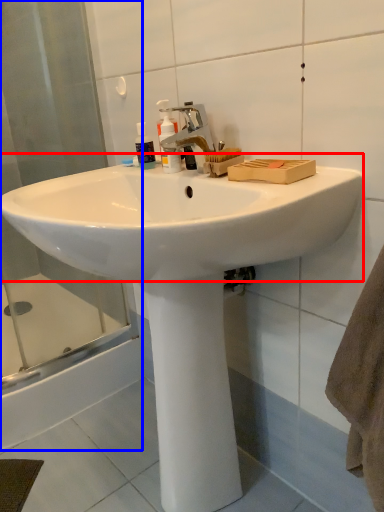
Question: Which of the following is the closest to the observer, sink (highlighted by a red box) or shower door (highlighted by a blue box)?

Choices:
 (A) sink
 (B) shower door

Answer: (A)